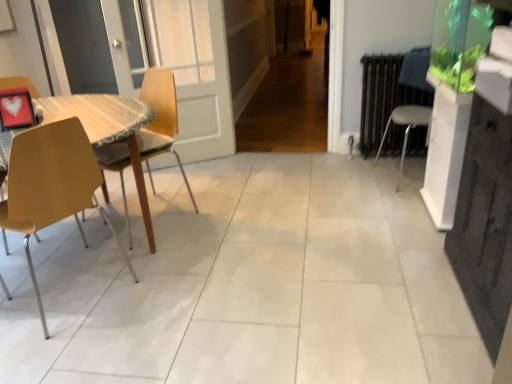
Where is `vacant space to the right of wooden at left, the 2th chair in the left-to-right sequence`? Image resolution: width=512 pixels, height=384 pixels. vacant space to the right of wooden at left, the 2th chair in the left-to-right sequence is located at coordinates (225, 215).